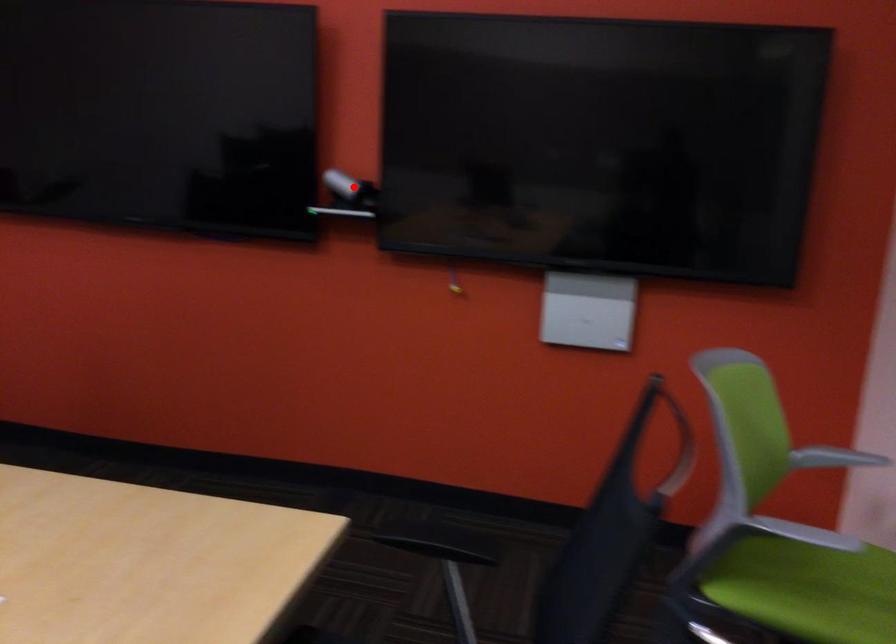
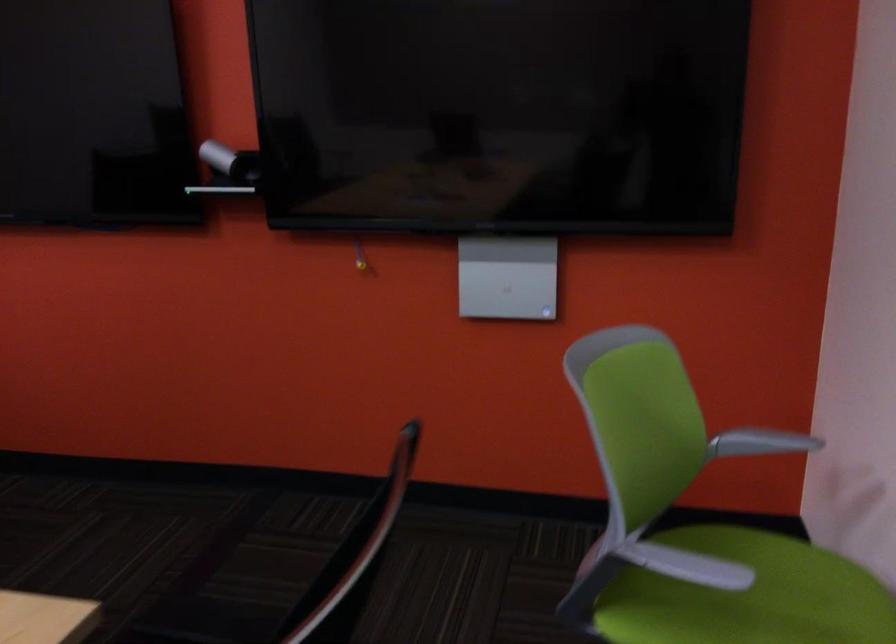
Question: I am providing you with two images of the same scene from different viewpoints. In image1, a red point is highlighted. Considering the same 3D point in image2, which of the following is correct?

Choices:
 (A) It is closer
 (B) It is farther

Answer: (A)